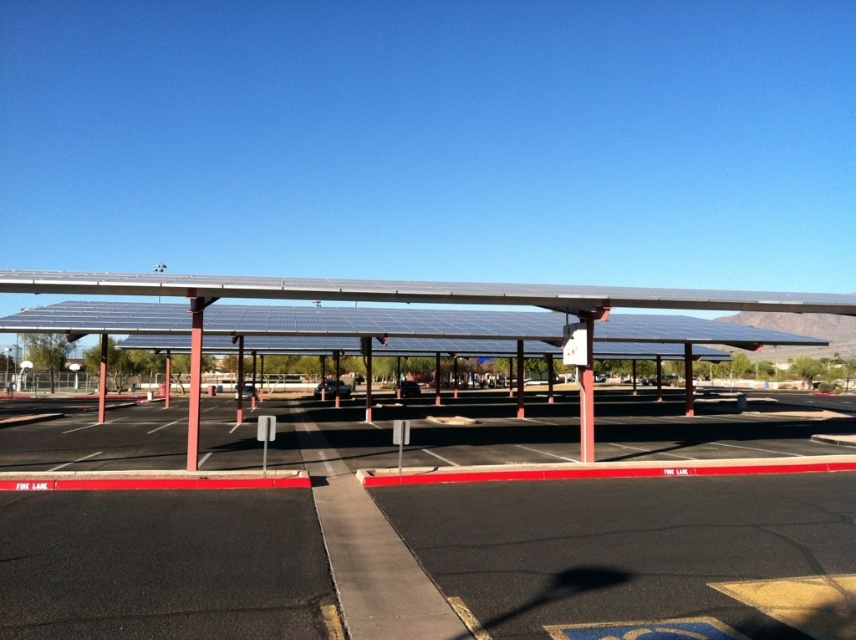
Question: Which object appears closest to the camera in this image?

Choices:
 (A) metallic pole at center
 (B) metallic solar panels at center

Answer: (B)

Question: Does metallic solar panels at center lie in front of metallic pole at center?

Choices:
 (A) yes
 (B) no

Answer: (A)

Question: Which object appears closest to the camera in this image?

Choices:
 (A) metallic pole at center
 (B) metallic solar panels at center

Answer: (B)

Question: Is metallic solar panels at center further to camera compared to metallic pole at center?

Choices:
 (A) yes
 (B) no

Answer: (B)

Question: Is metallic solar panels at center to the left of metallic pole at center from the viewer's perspective?

Choices:
 (A) yes
 (B) no

Answer: (B)

Question: Which of the following is the farthest from the observer?

Choices:
 (A) (417, 298)
 (B) (198, 333)

Answer: (A)